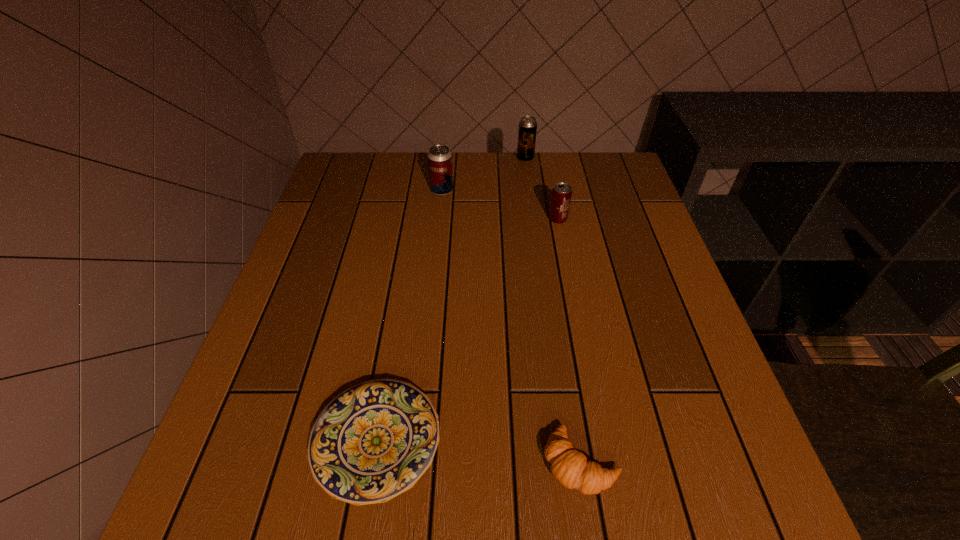
Identify the location of vacant position located 0.110m on the front of the third shortest object. (564, 254).

Where is `vacant region located on the left of the crescent roll`? vacant region located on the left of the crescent roll is located at coordinates (300, 462).

The width and height of the screenshot is (960, 540). What are the coordinates of `free space located 0.220m on the right of the plate` in the screenshot? It's located at (573, 441).

The height and width of the screenshot is (540, 960). I want to click on crescent roll located in the near edge section of the desktop, so click(569, 466).

Where is `plate that is at the near edge`? plate that is at the near edge is located at coordinates (373, 441).

Find the location of `object at the left edge`. object at the left edge is located at coordinates 373,441.

Identify the location of object that is at the near left corner. This screenshot has width=960, height=540. (373, 441).

The width and height of the screenshot is (960, 540). Identify the location of vacant point at the far edge. (493, 185).

The width and height of the screenshot is (960, 540). In order to click on vacant space at the near edge in this screenshot , I will do `click(505, 485)`.

Where is `vacant space at the left edge`? Image resolution: width=960 pixels, height=540 pixels. vacant space at the left edge is located at coordinates (271, 382).